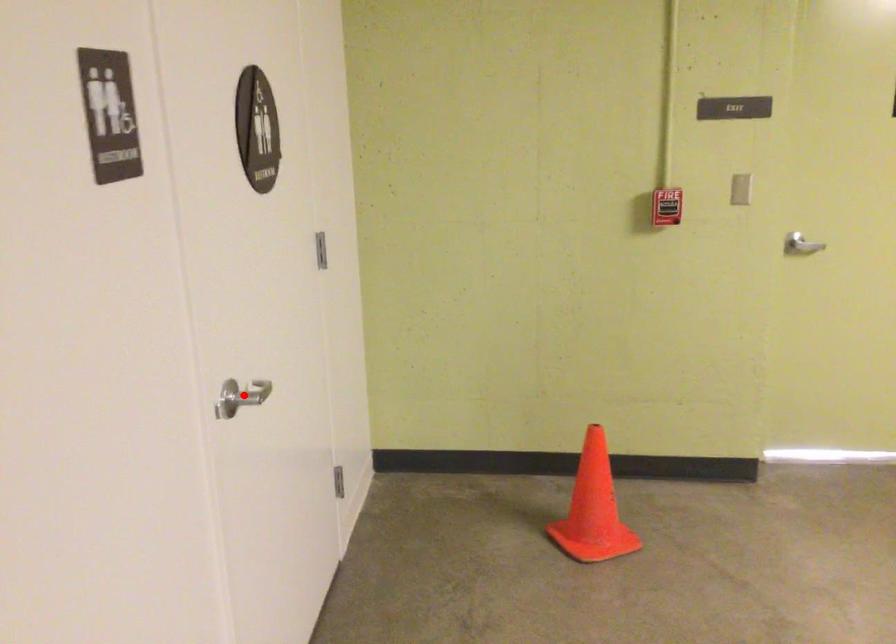
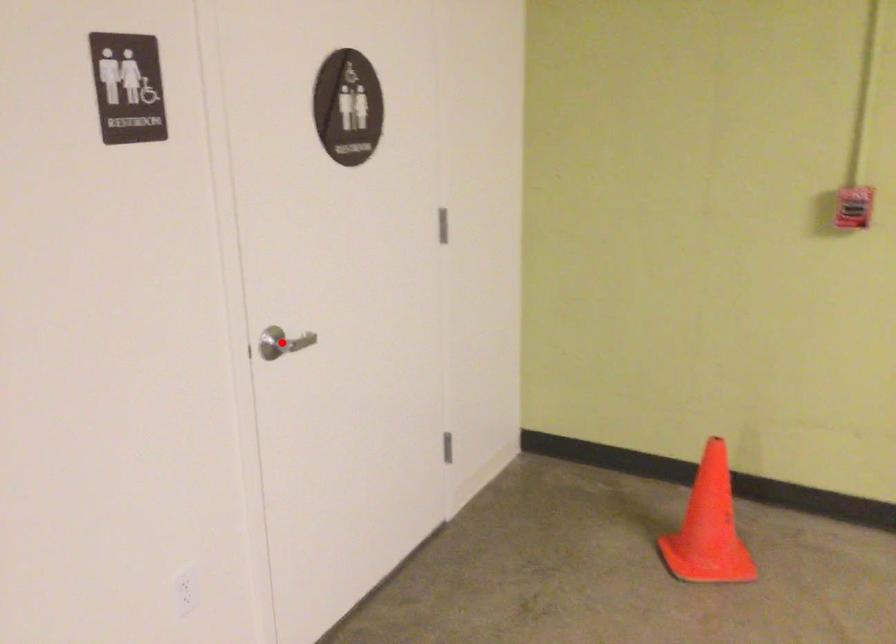
I am providing you with two images of the same scene from different viewpoints. A red point is marked on the first image and another point is marked on the second image. Do the highlighted points in image1 and image2 indicate the same real-world spot?

Yes